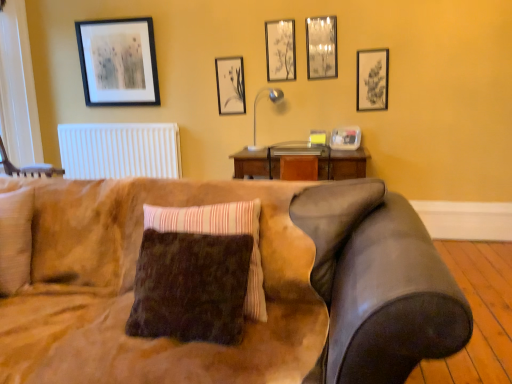
What do you see at coordinates (120, 150) in the screenshot? I see `white matte radiator at upper left` at bounding box center [120, 150].

Where is `metallic mirror at upper center, which is the 4th picture frame from left to right`? The width and height of the screenshot is (512, 384). metallic mirror at upper center, which is the 4th picture frame from left to right is located at coordinates (321, 47).

What do you see at coordinates (230, 85) in the screenshot? I see `matte black picture frame at upper center, arranged as the fifth picture frame when viewed from the right` at bounding box center [230, 85].

Locate an element on the screen. This screenshot has width=512, height=384. clear plastic container at upper right, positioned as the fifth picture frame in left-to-right order is located at coordinates (346, 138).

You are a GUI agent. You are given a task and a screenshot of the screen. Output one action in this format:
    pyautogui.click(x=<x>, y=<y>)
    Task: Click on the suede couch at center
    Image resolution: width=512 pixels, height=384 pixels.
    Given the screenshot: What is the action you would take?
    pyautogui.click(x=264, y=286)

Which object is positioned more to the left, wooden swivel chair at left or metallic mirror at upper center, which is the third picture frame in right-to-left order?

wooden swivel chair at left is more to the left.

Is wooden swivel chair at left smaller than metallic mirror at upper center, which is the third picture frame in right-to-left order?

Actually, wooden swivel chair at left might be larger than metallic mirror at upper center, which is the third picture frame in right-to-left order.

From a real-world perspective, which is physically above, wooden swivel chair at left or metallic mirror at upper center, which is the 4th picture frame from left to right?

metallic mirror at upper center, which is the 4th picture frame from left to right, from a real-world perspective.

Looking at this image, is wooden swivel chair at left directly adjacent to metallic mirror at upper center, which is the third picture frame in right-to-left order?

There is a gap between wooden swivel chair at left and metallic mirror at upper center, which is the third picture frame in right-to-left order.

Considering the sizes of objects metallic mirror at upper center, which is the third picture frame in right-to-left order, and metallic silver lamp at upper center in the image provided, who is wider, metallic mirror at upper center, which is the third picture frame in right-to-left order, or metallic silver lamp at upper center?

With larger width is metallic silver lamp at upper center.

Which point is more forward, (319, 20) or (255, 110)?

Point (319, 20)

What's the angular difference between metallic mirror at upper center, which is the third picture frame in right-to-left order, and metallic silver lamp at upper center's facing directions?

1.36 degrees.

Does metallic mirror at upper center, which is the 4th picture frame from left to right, turn towards metallic silver lamp at upper center?

No, metallic mirror at upper center, which is the 4th picture frame from left to right, is not facing towards metallic silver lamp at upper center.

At what (x,y) coordinates should I click in order to perform the action: click on swivel chair above the white matte radiator at upper left (from a real-world perspective). Please return your answer as a coordinate pair (x, y). Looking at the image, I should click on (27, 167).

From a real-world perspective, is wooden swivel chair at left positioned over white matte radiator at upper left based on gravity?

Yes, from a real-world perspective, wooden swivel chair at left is on top of white matte radiator at upper left.

Can you confirm if wooden swivel chair at left is smaller than white matte radiator at upper left?

Incorrect, wooden swivel chair at left is not smaller in size than white matte radiator at upper left.

Is white matte radiator at upper left a part of wooden swivel chair at left?

No, white matte radiator at upper left is not a part of wooden swivel chair at left.

The height and width of the screenshot is (384, 512). I want to click on pillow on the right side of suede couch at center, so click(219, 234).

Considering the relative sizes of brown fuzzy pillow at center and suede couch at center in the image provided, is brown fuzzy pillow at center thinner than suede couch at center?

Correct, the width of brown fuzzy pillow at center is less than that of suede couch at center.

Looking at this image, is brown fuzzy pillow at center bigger than suede couch at center?

Incorrect, brown fuzzy pillow at center is not larger than suede couch at center.

Is matte black picture frame at upper center, arranged as the fifth picture frame when viewed from the right, smaller than clear plastic container at upper right, the second picture frame from the right?

Yes, matte black picture frame at upper center, arranged as the fifth picture frame when viewed from the right, is smaller than clear plastic container at upper right, the second picture frame from the right.

Does matte black picture frame at upper center, arranged as the fifth picture frame when viewed from the right, come in front of clear plastic container at upper right, positioned as the fifth picture frame in left-to-right order?

No, matte black picture frame at upper center, arranged as the fifth picture frame when viewed from the right, is behind clear plastic container at upper right, positioned as the fifth picture frame in left-to-right order.

Identify the location of the 2nd picture frame located above the black matte picture frame at upper left, arranged as the 6th picture frame when viewed from the right (from a real-world perspective). This screenshot has width=512, height=384. (321, 47).

From their relative heights in the image, would you say black matte picture frame at upper left, which is counted as the 1th picture frame, starting from the left, is taller or shorter than metallic mirror at upper center, which is the third picture frame in right-to-left order?

Clearly, black matte picture frame at upper left, which is counted as the 1th picture frame, starting from the left, is taller compared to metallic mirror at upper center, which is the third picture frame in right-to-left order.

From the picture: In the image, is black matte picture frame at upper left, which is counted as the 1th picture frame, starting from the left, positioned in front of or behind metallic mirror at upper center, which is the 4th picture frame from left to right?

Visually, black matte picture frame at upper left, which is counted as the 1th picture frame, starting from the left, is located behind metallic mirror at upper center, which is the 4th picture frame from left to right.

Between matte black picture frame at upper center, arranged as the fifth picture frame when viewed from the right, and brown fuzzy pillow at center, which one is positioned behind?

matte black picture frame at upper center, arranged as the fifth picture frame when viewed from the right, is behind.

Considering the sizes of objects matte black picture frame at upper center, the 2th picture frame positioned from the left, and brown fuzzy pillow at center in the image provided, who is shorter, matte black picture frame at upper center, the 2th picture frame positioned from the left, or brown fuzzy pillow at center?

matte black picture frame at upper center, the 2th picture frame positioned from the left, is shorter.

Considering the sizes of objects matte black picture frame at upper center, arranged as the fifth picture frame when viewed from the right, and brown fuzzy pillow at center in the image provided, who is thinner, matte black picture frame at upper center, arranged as the fifth picture frame when viewed from the right, or brown fuzzy pillow at center?

With smaller width is matte black picture frame at upper center, arranged as the fifth picture frame when viewed from the right.

Looking at this image, from the image's perspective, between matte black picture frame at upper center, the 2th picture frame positioned from the left, and brown fuzzy pillow at center, which one is located above?

From the image's view, matte black picture frame at upper center, the 2th picture frame positioned from the left, is above.

Where is `the 3rd picture frame behind the wooden swivel chair at left`? The width and height of the screenshot is (512, 384). the 3rd picture frame behind the wooden swivel chair at left is located at coordinates (321, 47).

The width and height of the screenshot is (512, 384). What are the coordinates of `lamp below the metallic mirror at upper center, which is the 4th picture frame from left to right (from a real-world perspective)` in the screenshot? It's located at (256, 105).

From the image, which object appears to be nearer to wooden swivel chair at left, white matte radiator at upper left or metallic silver lamp at upper center?

The object closer to wooden swivel chair at left is white matte radiator at upper left.

Looking at the image, which one is located closer to matte black picture frame at upper center, arranged as the fifth picture frame when viewed from the right, black matte picture frame at upper left, arranged as the 6th picture frame when viewed from the right, or brown fuzzy pillow at center?

Based on the image, black matte picture frame at upper left, arranged as the 6th picture frame when viewed from the right, appears to be nearer to matte black picture frame at upper center, arranged as the fifth picture frame when viewed from the right.

Which object lies further to the anchor point matte black picture frame at upper center, arranged as the fifth picture frame when viewed from the right, white matte radiator at upper left or metallic silver lamp at upper center?

The object further to matte black picture frame at upper center, arranged as the fifth picture frame when viewed from the right, is white matte radiator at upper left.

From the image, which object appears to be farther from black matte picture frame at upper left, arranged as the 6th picture frame when viewed from the right, clear plastic container at upper right, positioned as the fifth picture frame in left-to-right order, or matte black picture frame at upper center, the 3th picture frame when ordered from left to right?

clear plastic container at upper right, positioned as the fifth picture frame in left-to-right order.

Looking at the image, which one is located closer to clear plastic container at upper right, positioned as the fifth picture frame in left-to-right order, matte black picture frame at upper center, the 2th picture frame positioned from the left, or matte black picture frame at upper center, the fourth picture frame viewed from the right?

Among the two, matte black picture frame at upper center, the fourth picture frame viewed from the right, is located nearer to clear plastic container at upper right, positioned as the fifth picture frame in left-to-right order.

Which object lies nearer to the anchor point black matte picture frame at upper left, arranged as the 6th picture frame when viewed from the right, clear glass window at left or suede couch at center?

clear glass window at left is positioned closer to the anchor black matte picture frame at upper left, arranged as the 6th picture frame when viewed from the right.

Which object lies further to the anchor point metallic mirror at upper center, which is the third picture frame in right-to-left order, suede couch at center or white matte radiator at upper left?

The object further to metallic mirror at upper center, which is the third picture frame in right-to-left order, is suede couch at center.

Considering their positions, is metallic mirror at upper center, which is the third picture frame in right-to-left order, positioned closer to brown fuzzy pillow at center than clear plastic container at upper right, positioned as the fifth picture frame in left-to-right order?

clear plastic container at upper right, positioned as the fifth picture frame in left-to-right order, is closer to brown fuzzy pillow at center.

In order to click on pillow between clear glass window at left and matte black picture frame at upper center, the fourth picture frame viewed from the right, in the horizontal direction in this screenshot , I will do `click(219, 234)`.

The height and width of the screenshot is (384, 512). What are the coordinates of `radiator situated between clear glass window at left and metallic silver lamp at upper center from left to right` in the screenshot? It's located at (120, 150).

The width and height of the screenshot is (512, 384). What are the coordinates of `swivel chair between suede couch at center and metallic mirror at upper center, which is the 4th picture frame from left to right, in the front-back direction` in the screenshot? It's located at (27, 167).

Locate an element on the screen. The image size is (512, 384). window positioned between suede couch at center and white matte radiator at upper left from near to far is located at coordinates (18, 88).